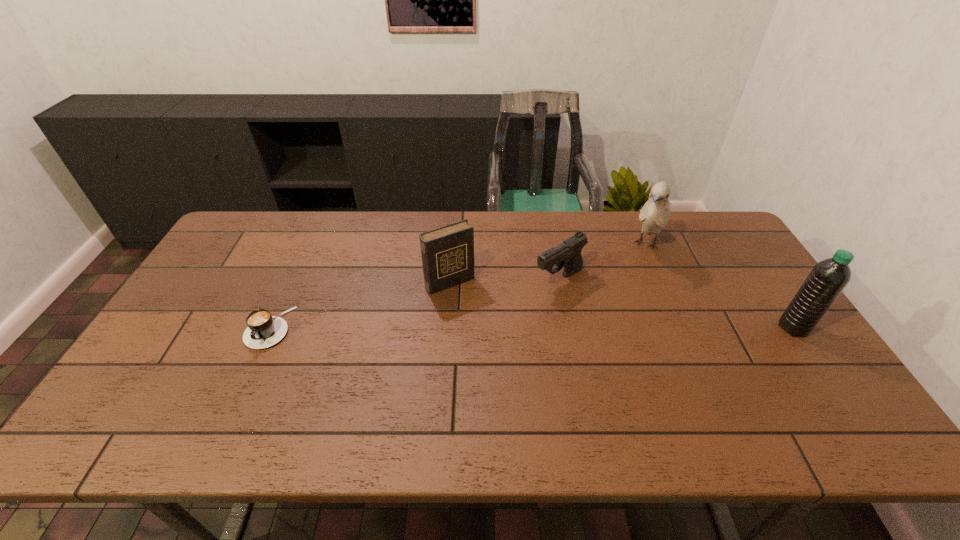
The width and height of the screenshot is (960, 540). In order to click on vacant region located 0.180m at the barrel of the third object from left to right in this screenshot , I will do `click(495, 319)`.

The height and width of the screenshot is (540, 960). Find the location of `vacant region located 0.180m at the barrel of the third object from left to right`. vacant region located 0.180m at the barrel of the third object from left to right is located at coordinates (495, 319).

The height and width of the screenshot is (540, 960). Find the location of `free space located on the front cover of the fourth object from right to left`. free space located on the front cover of the fourth object from right to left is located at coordinates (x=516, y=369).

Locate an element on the screen. The height and width of the screenshot is (540, 960). vacant space positioned 0.360m on the front cover of the fourth object from right to left is located at coordinates (526, 384).

Image resolution: width=960 pixels, height=540 pixels. I want to click on vacant space located on the front cover of the fourth object from right to left, so (496, 342).

Find the location of a particular element. This screenshot has height=540, width=960. vacant space located 0.390m at the beak of the second object from right to left is located at coordinates (600, 343).

The height and width of the screenshot is (540, 960). Identify the location of free location located at the beak of the second object from right to left. (626, 295).

The width and height of the screenshot is (960, 540). Find the location of `free location located 0.280m at the beak of the second object from right to left`. free location located 0.280m at the beak of the second object from right to left is located at coordinates (614, 317).

You are a GUI agent. You are given a task and a screenshot of the screen. Output one action in this format:
    pyautogui.click(x=<x>, y=<y>)
    Task: Click on the object that is at the far edge
    
    Given the screenshot: What is the action you would take?
    pyautogui.click(x=655, y=214)

Where is `object that is at the right edge`? The image size is (960, 540). object that is at the right edge is located at coordinates (827, 279).